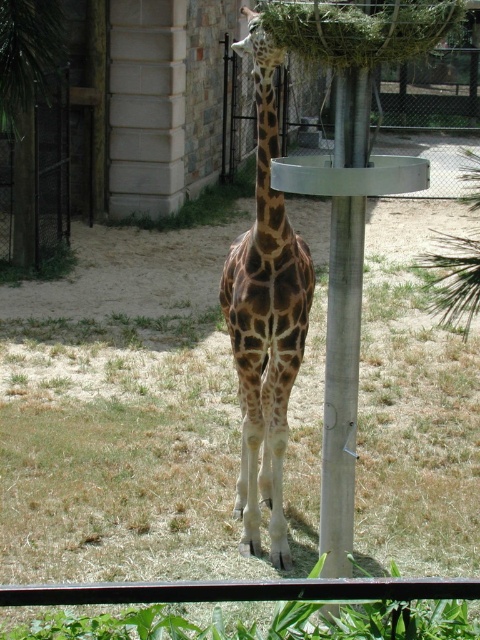
You are a zookeeper trying to determine the best path to approach the giraffe without startling it. You notice two points marked in the image. The first point is at coordinate point (250,44) and the second is at coordinate point (360,93). Which point is closer to you, the zookeeper, and would allow for a safer approach?

Point (250,44) is closer to you than point (360,93), so approaching from that point would be safer as it is nearer to your position.

You are a zookeeper who wants to ensure the giraffe is eating properly. From your perspective, where is the green grass at center located relative to the spotted fur giraffe at center?

The green grass at center is positioned on the left side of the spotted fur giraffe at center.